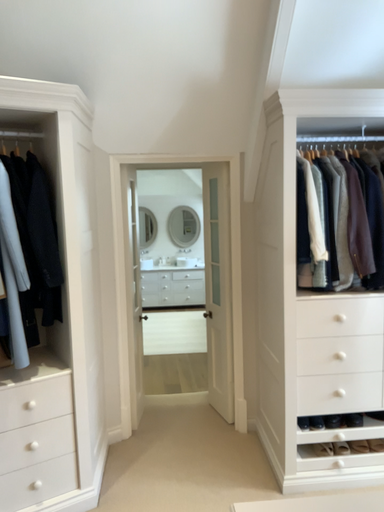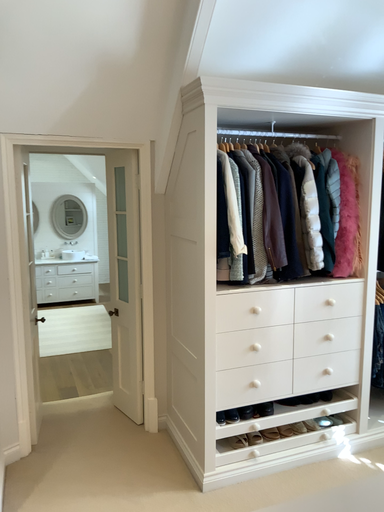
Question: Which way did the camera rotate in the video?

Choices:
 (A) rotated right
 (B) rotated left

Answer: (A)